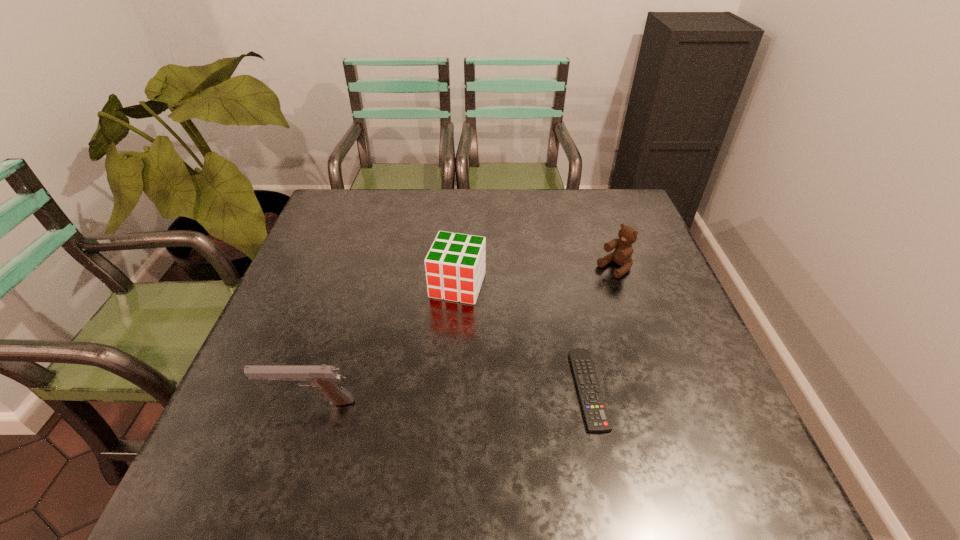
At what (x,y) coordinates should I click in order to perform the action: click on vacant space located 0.390m on the face of the rightmost object. Please return your answer as a coordinate pair (x, y). This screenshot has height=540, width=960. Looking at the image, I should click on (491, 349).

Where is `vacant space located 0.390m on the face of the rightmost object`? vacant space located 0.390m on the face of the rightmost object is located at coordinates (491, 349).

At what (x,y) coordinates should I click in order to perform the action: click on pistol located in the near edge section of the desktop. Please return your answer as a coordinate pair (x, y). The width and height of the screenshot is (960, 540). Looking at the image, I should click on (325, 378).

Locate an element on the screen. Image resolution: width=960 pixels, height=540 pixels. remote control located in the near edge section of the desktop is located at coordinates (595, 413).

This screenshot has height=540, width=960. Find the location of `object situated at the left edge`. object situated at the left edge is located at coordinates (325, 378).

Where is `object that is at the right edge`? The height and width of the screenshot is (540, 960). object that is at the right edge is located at coordinates (622, 255).

At what (x,y) coordinates should I click in order to perform the action: click on object present at the near left corner. Please return your answer as a coordinate pair (x, y). Looking at the image, I should click on (325, 378).

Find the location of `vacant space at the far edge of the desktop`. vacant space at the far edge of the desktop is located at coordinates (412, 209).

In the image, there is a desktop. Find the location of `vacant space at the left edge`. vacant space at the left edge is located at coordinates (313, 300).

In the image, there is a desktop. In order to click on blank space at the right edge in this screenshot , I will do `click(659, 304)`.